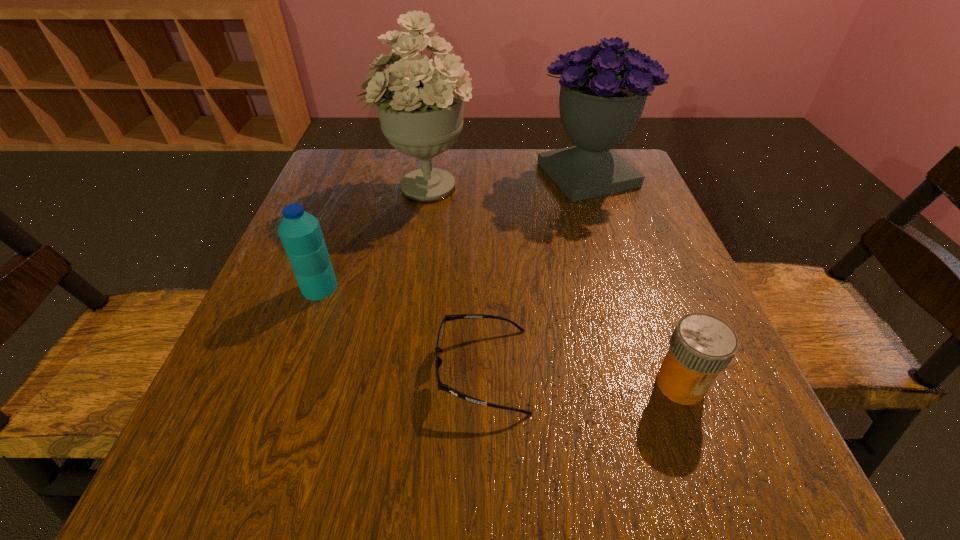
In order to click on free point between the fourth shortest object and the shortest object in this screenshot , I will do `click(535, 273)`.

What are the coordinates of `vacant space in between the left bouquet and the medicine` in the screenshot? It's located at (552, 285).

Where is `unoccupied area between the left bouquet and the second shortest object`? The height and width of the screenshot is (540, 960). unoccupied area between the left bouquet and the second shortest object is located at coordinates (552, 285).

I want to click on vacant area that lies between the left bouquet and the fourth tallest object, so (552, 285).

Find the location of a particular element. The width and height of the screenshot is (960, 540). vacant space in between the sunglasses and the fourth tallest object is located at coordinates (582, 377).

Identify the location of unoccupied position between the left bouquet and the shorter bouquet. The image size is (960, 540). (506, 180).

Identify which object is the fourth closest to the right bouquet. Please provide its 2D coordinates. Your answer should be formatted as a tuple, i.e. [(x, y)], where the tuple contains the x and y coordinates of a point satisfying the conditions above.

[(300, 232)]

Identify the location of object that stands as the third closest to the shorter bouquet. Image resolution: width=960 pixels, height=540 pixels. (701, 346).

Identify the location of vacant space that satisfies the following two spatial constraints: 1. on the back side of the shorter bouquet; 2. on the right side of the water bottle. (361, 175).

I want to click on vacant space that satisfies the following two spatial constraints: 1. on the front side of the right bouquet; 2. on the front-facing side of the shortest object, so click(x=651, y=370).